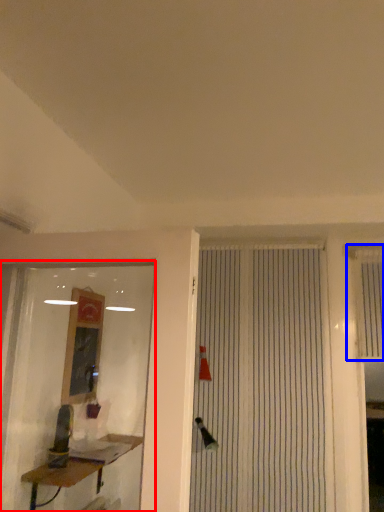
Question: Among these objects, which one is farthest to the camera, shop window (highlighted by a red box) or shutter (highlighted by a blue box)?

Choices:
 (A) shop window
 (B) shutter

Answer: (B)